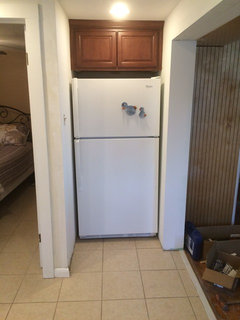
What are the coordinates of `cabinet doors` in the screenshot? It's located at (103, 52), (133, 48).